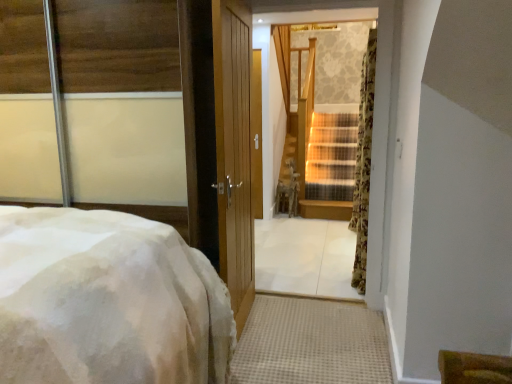
Question: From a real-world perspective, is wooden staircase at center located beneath floral fabric curtain at right?

Choices:
 (A) no
 (B) yes

Answer: (A)

Question: Is wooden staircase at center far from floral fabric curtain at right?

Choices:
 (A) no
 (B) yes

Answer: (B)

Question: Is wooden staircase at center located outside floral fabric curtain at right?

Choices:
 (A) yes
 (B) no

Answer: (A)

Question: From the image's perspective, is wooden staircase at center above floral fabric curtain at right?

Choices:
 (A) yes
 (B) no

Answer: (B)

Question: Is wooden staircase at center to the left of floral fabric curtain at right from the viewer's perspective?

Choices:
 (A) no
 (B) yes

Answer: (B)

Question: Can you confirm if wooden staircase at center is wider than floral fabric curtain at right?

Choices:
 (A) yes
 (B) no

Answer: (A)

Question: Is wooden staircase at center with white fluffy bed at left?

Choices:
 (A) no
 (B) yes

Answer: (A)

Question: Does wooden staircase at center appear on the right side of white fluffy bed at left?

Choices:
 (A) no
 (B) yes

Answer: (B)

Question: Is wooden staircase at center turned away from white fluffy bed at left?

Choices:
 (A) no
 (B) yes

Answer: (A)

Question: Is white fluffy bed at left surrounded by wooden staircase at center?

Choices:
 (A) yes
 (B) no

Answer: (B)

Question: Is wooden staircase at center smaller than white fluffy bed at left?

Choices:
 (A) yes
 (B) no

Answer: (A)

Question: Does wooden staircase at center have a lesser width compared to white fluffy bed at left?

Choices:
 (A) no
 (B) yes

Answer: (B)

Question: Would you say floral fabric curtain at right is a long distance from white fluffy bed at left?

Choices:
 (A) yes
 (B) no

Answer: (A)